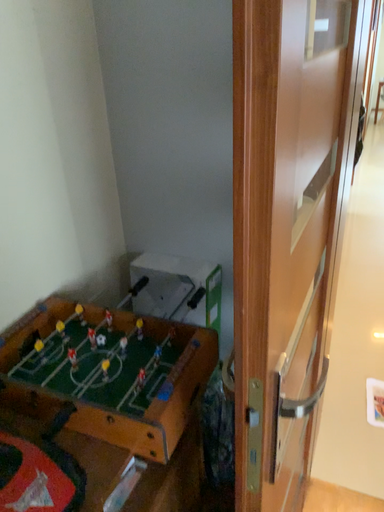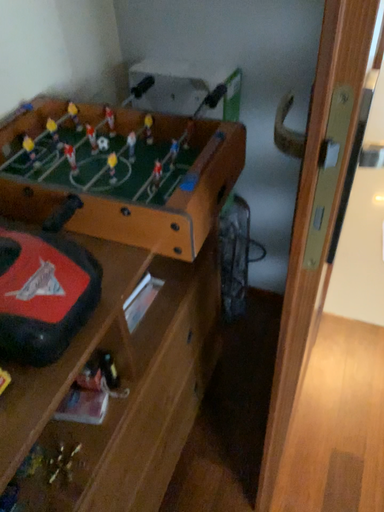
Question: Which way did the camera rotate in the video?

Choices:
 (A) rotated upward
 (B) rotated downward

Answer: (B)